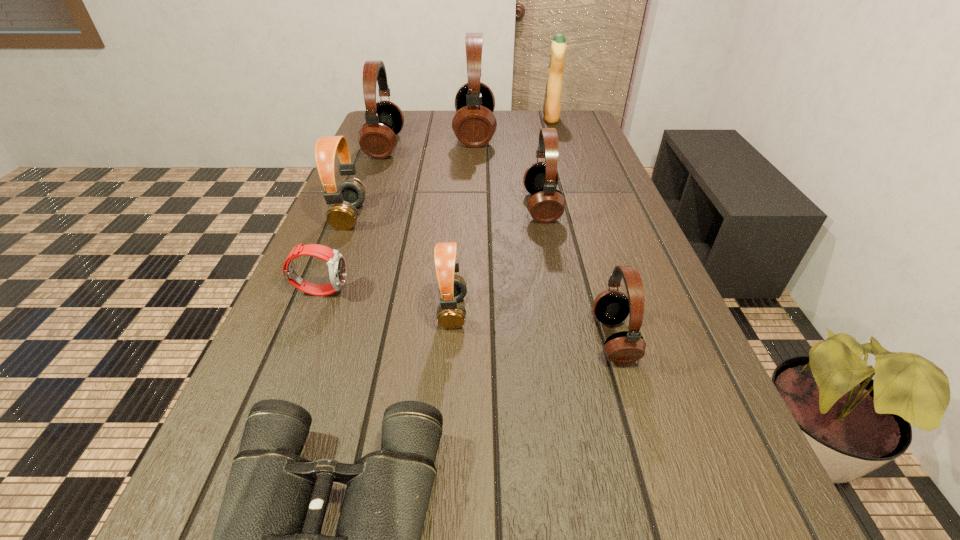
Identify which object is the third nearest to the nearest black headset. Please provide its 2D coordinates. Your answer should be formatted as a tuple, i.e. [(x, y)], where the tuple contains the x and y coordinates of a point satisfying the conditions above.

[(546, 204)]

The width and height of the screenshot is (960, 540). Identify the location of headset that can be found as the fourth closest to the third shortest object. (611, 307).

I want to click on the second closest headset to the second headset from right to left, so [x=452, y=288].

At what (x,y) coordinates should I click in order to perform the action: click on black headset object that ranks as the closest to the ninth tallest object. Please return your answer as a coordinate pair (x, y). Looking at the image, I should click on (611, 307).

Locate which black headset is the closest to the third biggest black headset. Please provide its 2D coordinates. Your answer should be formatted as a tuple, i.e. [(x, y)], where the tuple contains the x and y coordinates of a point satisfying the conditions above.

[(474, 124)]